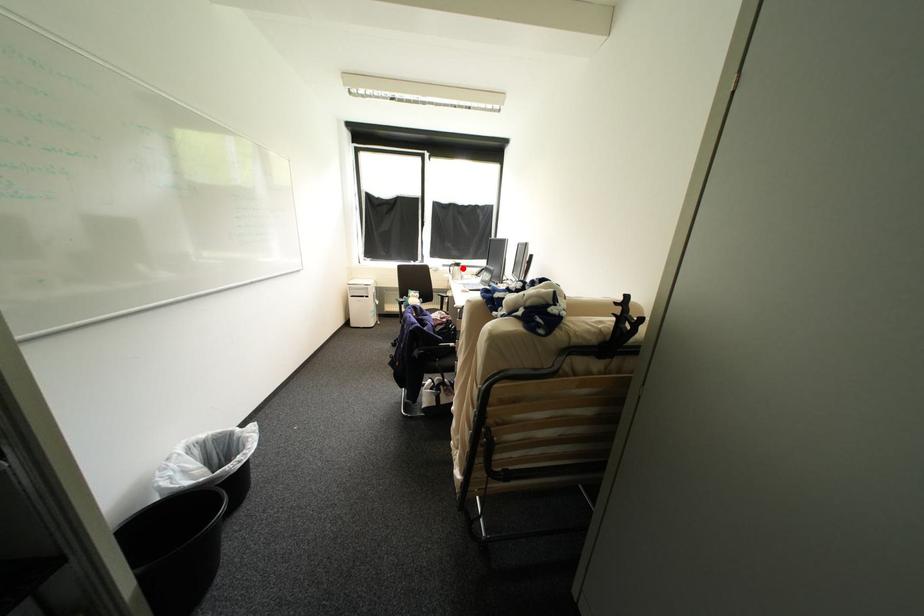
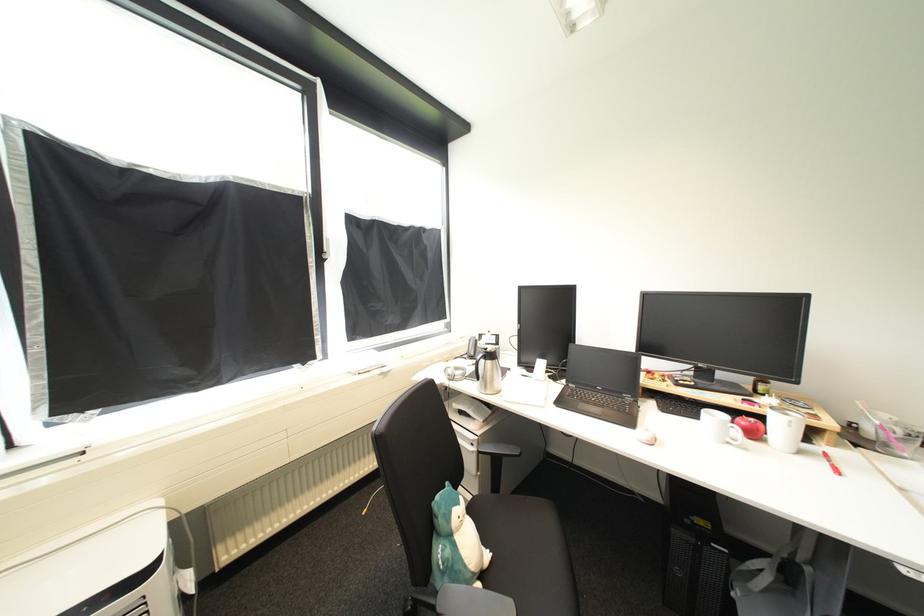
Question: I am providing you with two images of the same scene from different viewpoints. Image1 has a red point marked. In image2, the corresponding 3D location appears at what relative position? Reply with the corresponding letter.

Choices:
 (A) Closer
 (B) Farther

Answer: (B)